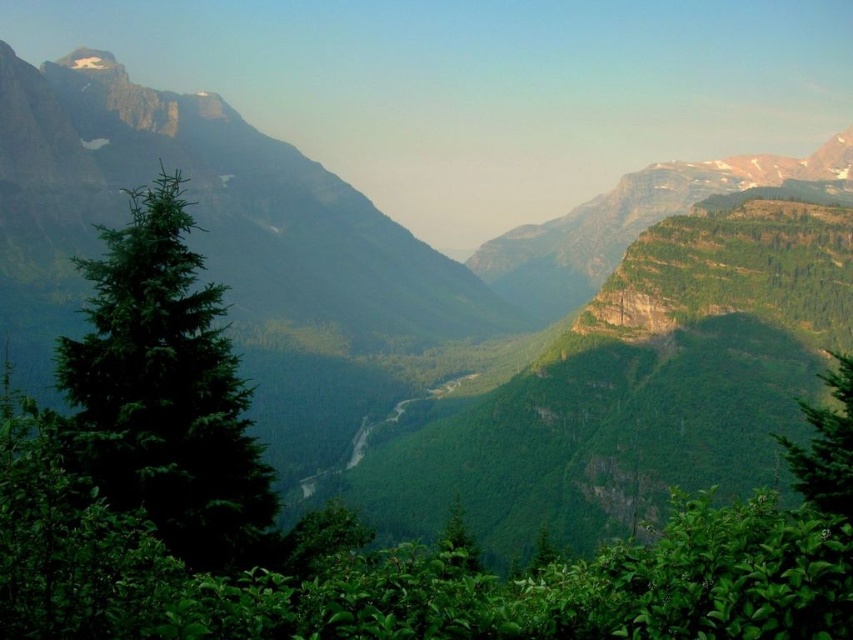
Where is `green matte tree at left`? This screenshot has width=853, height=640. green matte tree at left is located at coordinates (166, 392).

Does green matte tree at left appear on the right side of green leafy tree at right?

Incorrect, green matte tree at left is not on the right side of green leafy tree at right.

The image size is (853, 640). What are the coordinates of `green matte tree at left` in the screenshot? It's located at (166, 392).